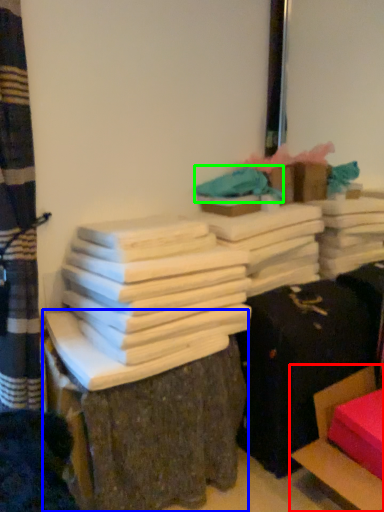
Question: Estimate the real-world distances between objects in this image. Which object is farther from furniture (highlighted by a red box), furniture (highlighted by a blue box) or fabric (highlighted by a green box)?

Choices:
 (A) furniture
 (B) fabric

Answer: (B)